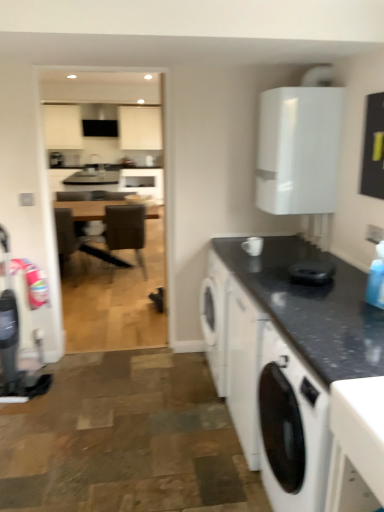
Question: In the image, is white glossy cabinet at upper right on the left side or the right side of white ceramic mug at upper center, the 1th appliance viewed from the left?

Choices:
 (A) left
 (B) right

Answer: (B)

Question: Considering the positions of point (276, 172) and point (258, 237), is point (276, 172) closer or farther from the camera than point (258, 237)?

Choices:
 (A) farther
 (B) closer

Answer: (B)

Question: Which of these objects is positioned closest to the black glossy coffee cup at center, which is the 1th appliance from front to back?

Choices:
 (A) white ceramic mug at upper center, acting as the second appliance starting from the bottom
 (B) black granite countertop at lower right
 (C) brown wooden table at center
 (D) white glossy cabinet at upper right
 (E) brown leather chair at center

Answer: (B)

Question: Estimate the real-world distances between objects in this image. Which object is closer to the black granite countertop at lower right?

Choices:
 (A) white ceramic mug at upper center, acting as the second appliance starting from the bottom
 (B) white glossy cabinet at upper right
 (C) white matte washing machine at lower right
 (D) brown leather chair at center
 (E) brown wooden table at center

Answer: (C)